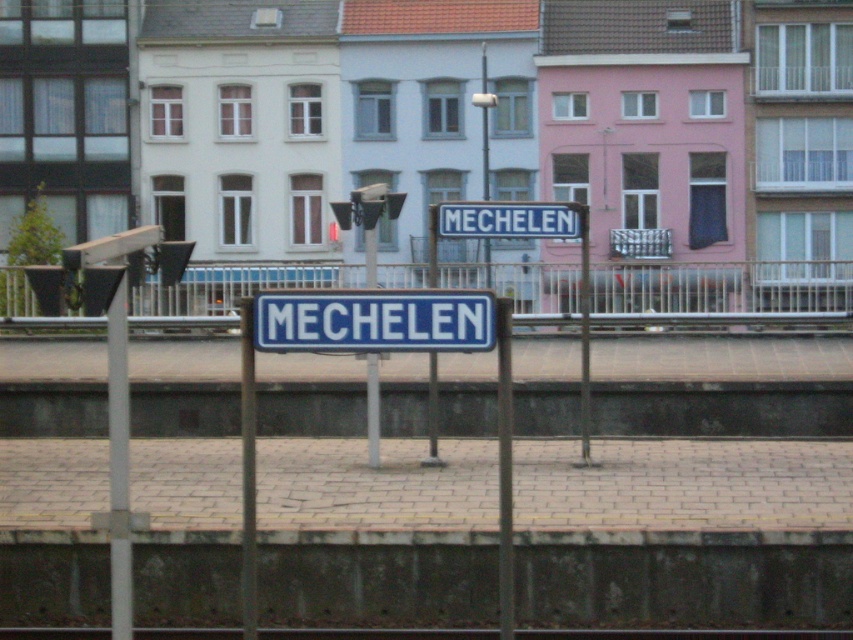
Question: Considering the real-world distances, which object is closest to the metallic gray train track at center?

Choices:
 (A) blue metallic sign at center
 (B) blue metal rail at center

Answer: (A)

Question: Does blue metal rail at center come behind blue metallic sign at center?

Choices:
 (A) no
 (B) yes

Answer: (A)

Question: Which object appears farthest from the camera in this image?

Choices:
 (A) blue metal rail at center
 (B) metallic gray train track at center
 (C) blue metallic sign at center

Answer: (C)

Question: Which point is farther to the camera?

Choices:
 (A) (462, 209)
 (B) (170, 308)
 (C) (61, 628)

Answer: (B)

Question: Is blue metal rail at center below metallic gray train track at center?

Choices:
 (A) no
 (B) yes

Answer: (A)

Question: Can you confirm if blue metal rail at center is wider than blue metallic sign at center?

Choices:
 (A) no
 (B) yes

Answer: (B)